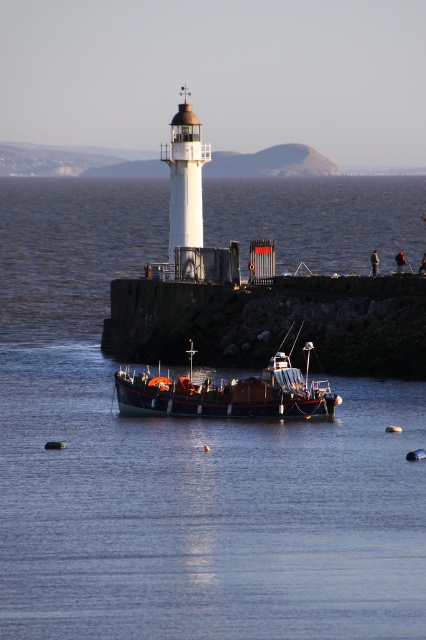
Question: Among these objects, which one is nearest to the camera?

Choices:
 (A) wooden boat at center
 (B) transparent water at center

Answer: (B)

Question: Among these points, which one is farthest from the camera?

Choices:
 (A) (230, 385)
 (B) (149, 209)

Answer: (B)

Question: Is transparent water at center above wooden boat at center?

Choices:
 (A) no
 (B) yes

Answer: (B)

Question: Is transparent water at center bigger than wooden boat at center?

Choices:
 (A) yes
 (B) no

Answer: (A)

Question: Among these objects, which one is farthest from the camera?

Choices:
 (A) transparent water at center
 (B) wooden boat at center

Answer: (B)

Question: Does transparent water at center come in front of wooden boat at center?

Choices:
 (A) yes
 (B) no

Answer: (A)